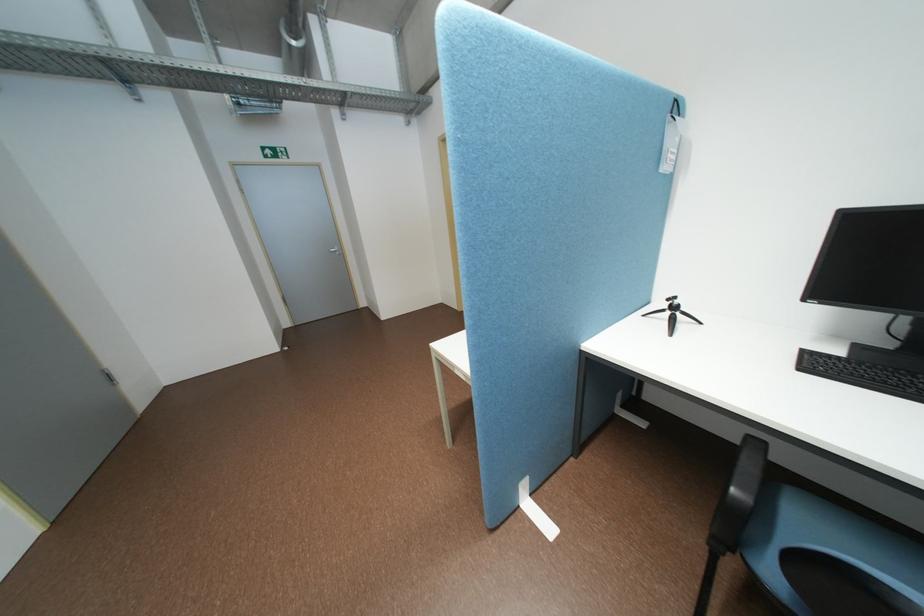
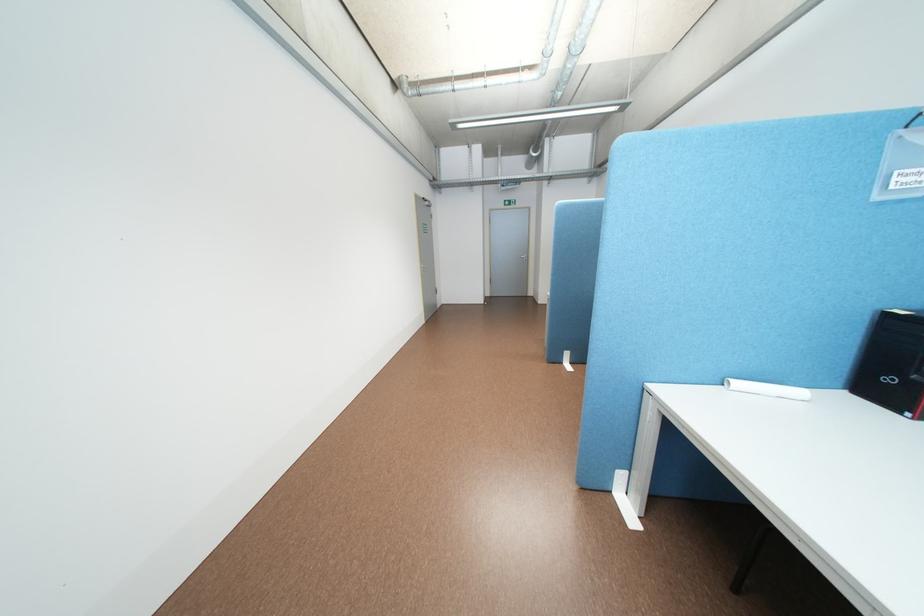
Where in the second image is the point corresponding to [298,323] from the first image?

(499, 294)